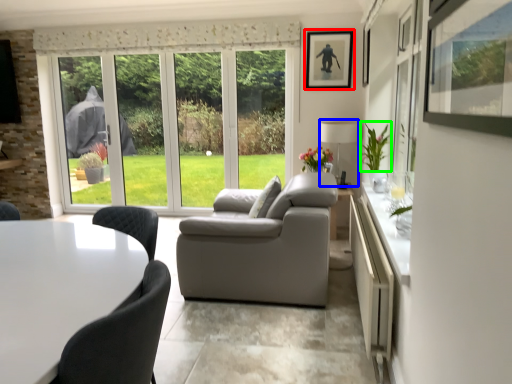
Question: Which is nearer to the picture frame (highlighted by a red box)? lamp (highlighted by a blue box) or plant (highlighted by a green box).

Choices:
 (A) lamp
 (B) plant

Answer: (A)